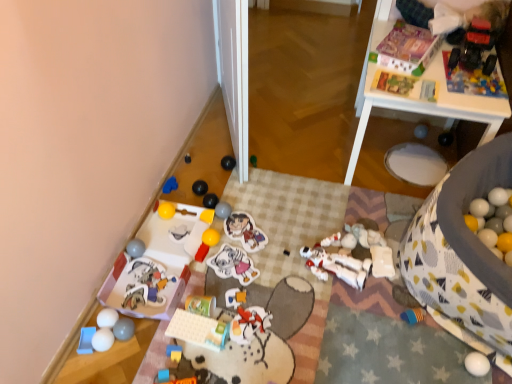
Question: Considering the relative sizes of black rubber ball at center, the 12th toy from the left, and white glossy table at upper right in the image provided, is black rubber ball at center, the 12th toy from the left, thinner than white glossy table at upper right?

Choices:
 (A) yes
 (B) no

Answer: (A)

Question: From the image's perspective, is black rubber ball at center, positioned as the fifteenth toy in right-to-left order, on white glossy table at upper right?

Choices:
 (A) no
 (B) yes

Answer: (A)

Question: Is black rubber ball at center, positioned as the fifteenth toy in right-to-left order, bigger than white glossy table at upper right?

Choices:
 (A) no
 (B) yes

Answer: (A)

Question: Considering the relative positions of black rubber ball at center, the 12th toy from the left, and white glossy table at upper right in the image provided, is black rubber ball at center, the 12th toy from the left, to the right of white glossy table at upper right from the viewer's perspective?

Choices:
 (A) yes
 (B) no

Answer: (B)

Question: Is black rubber ball at center, positioned as the fifteenth toy in right-to-left order, to the left of white glossy table at upper right from the viewer's perspective?

Choices:
 (A) yes
 (B) no

Answer: (A)

Question: From a real-world perspective, is rubber yellow block at lower center, the sixteenth toy when ordered from right to left, above or below yellow rubber ball at lower left, which appears as the 20th toy when viewed from the right?

Choices:
 (A) below
 (B) above

Answer: (B)

Question: Based on their sizes in the image, would you say rubber yellow block at lower center, the sixteenth toy when ordered from right to left, is bigger or smaller than yellow rubber ball at lower left, the 7th toy from the left?

Choices:
 (A) big
 (B) small

Answer: (B)

Question: Do you think rubber yellow block at lower center, the sixteenth toy when ordered from right to left, is within yellow rubber ball at lower left, which appears as the 20th toy when viewed from the right, or outside of it?

Choices:
 (A) inside
 (B) outside

Answer: (B)

Question: Does point (173, 360) appear closer or farther from the camera than point (158, 208)?

Choices:
 (A) farther
 (B) closer

Answer: (B)

Question: From a real-world perspective, is blue plastic tray at lower left, the 1th toy when ordered from left to right, positioned above or below white glossy table at upper right?

Choices:
 (A) below
 (B) above

Answer: (A)

Question: Looking at the image, does blue plastic tray at lower left, which ranks as the 26th toy in right-to-left order, seem bigger or smaller compared to white glossy table at upper right?

Choices:
 (A) small
 (B) big

Answer: (A)

Question: Is point (88, 336) positioned closer to the camera than point (422, 109)?

Choices:
 (A) farther
 (B) closer

Answer: (B)

Question: Considering their positions, is blue plastic tray at lower left, the 1th toy when ordered from left to right, located in front of or behind white glossy table at upper right?

Choices:
 (A) behind
 (B) front

Answer: (B)

Question: Is rubber ball at center, the tenth toy when ordered from right to left, in front of or behind matte gray ball at lower left, which is counted as the third toy, starting from the left, in the image?

Choices:
 (A) front
 (B) behind

Answer: (B)

Question: Looking at the image, does rubber ball at center, which ranks as the seventeenth toy in left-to-right order, seem bigger or smaller compared to matte gray ball at lower left, positioned as the 24th toy in right-to-left order?

Choices:
 (A) small
 (B) big

Answer: (A)